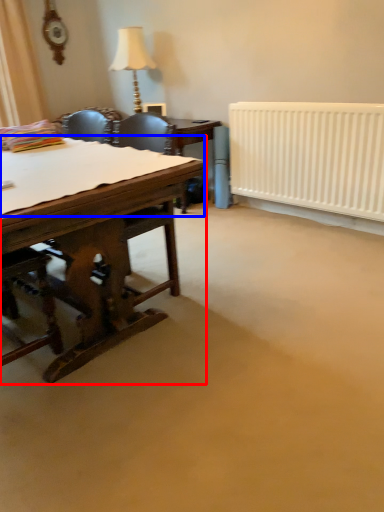
Question: Which of the following is the farthest to the observer, desk (highlighted by a red box) or sheet (highlighted by a blue box)?

Choices:
 (A) desk
 (B) sheet

Answer: (B)